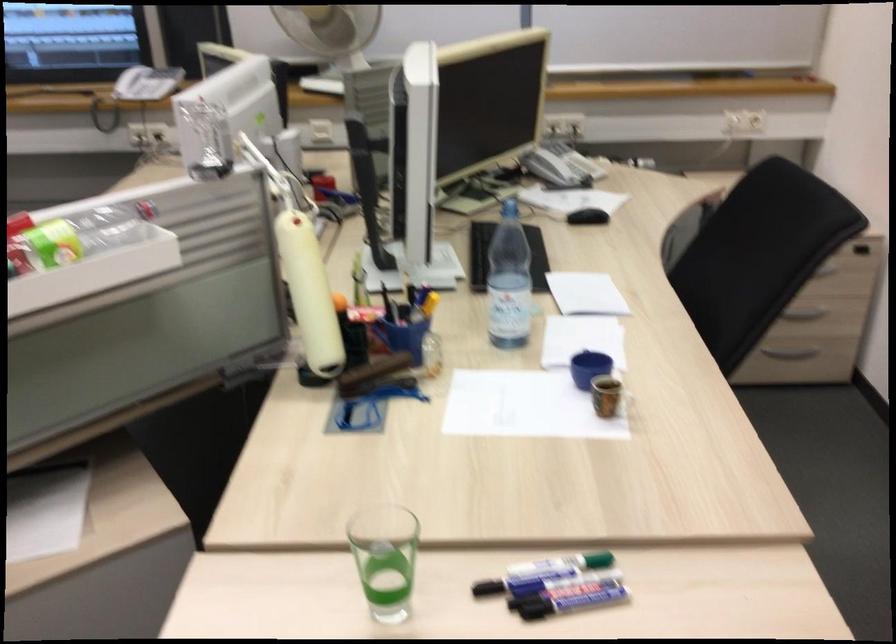
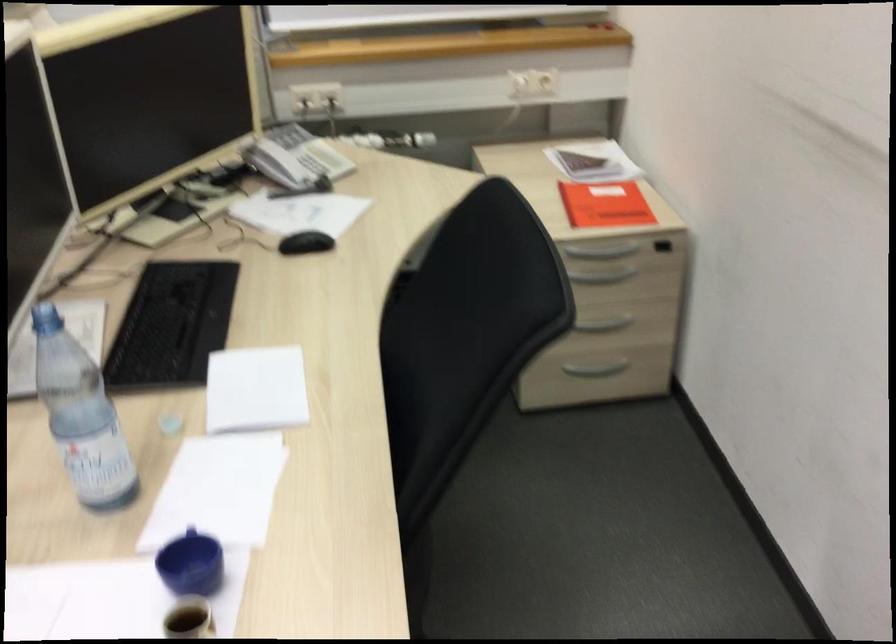
Question: How did the camera likely rotate?

Choices:
 (A) Left
 (B) Right
 (C) Up
 (D) Down

Answer: (B)